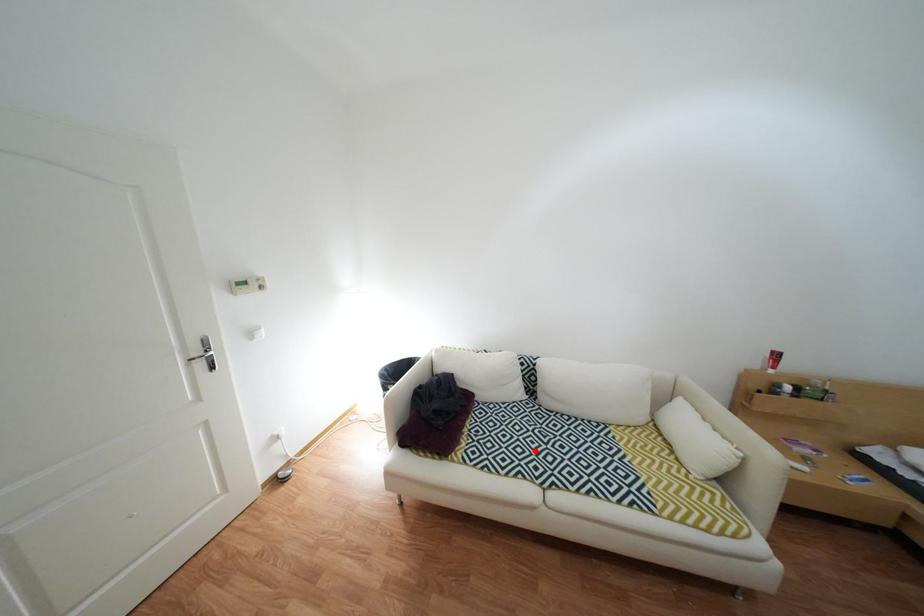
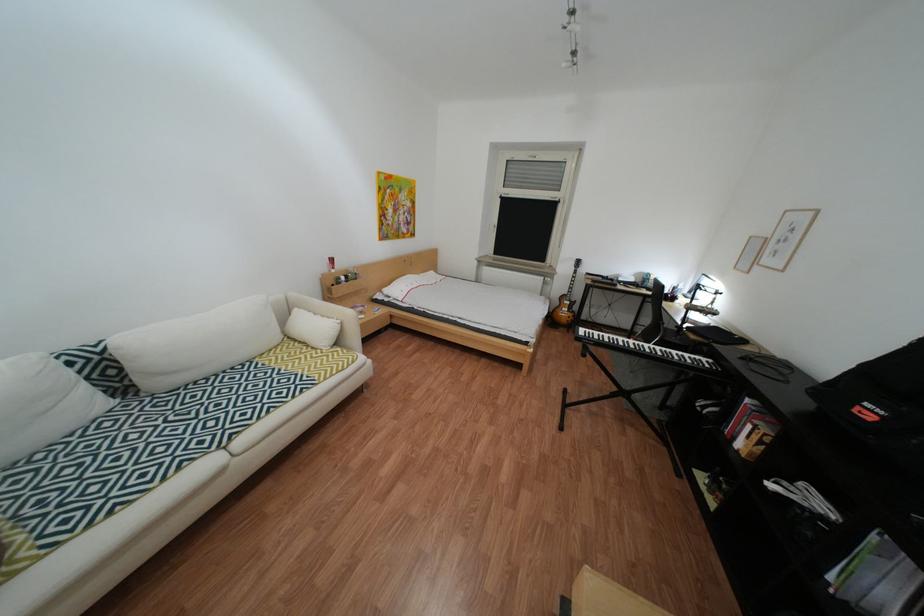
Find the pixel in the second image that matches the highlighted location in the first image.

(176, 450)